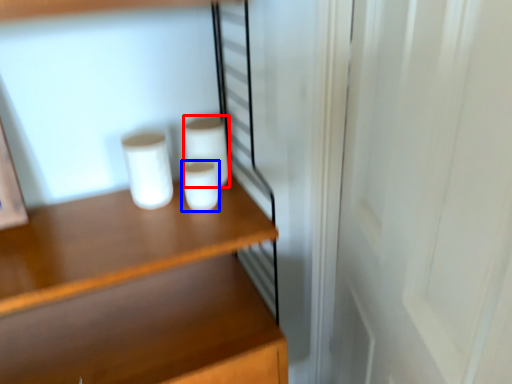
Question: Which of the following is the closest to the observer, paper towel (highlighted by a red box) or paper towel (highlighted by a blue box)?

Choices:
 (A) paper towel
 (B) paper towel

Answer: (B)